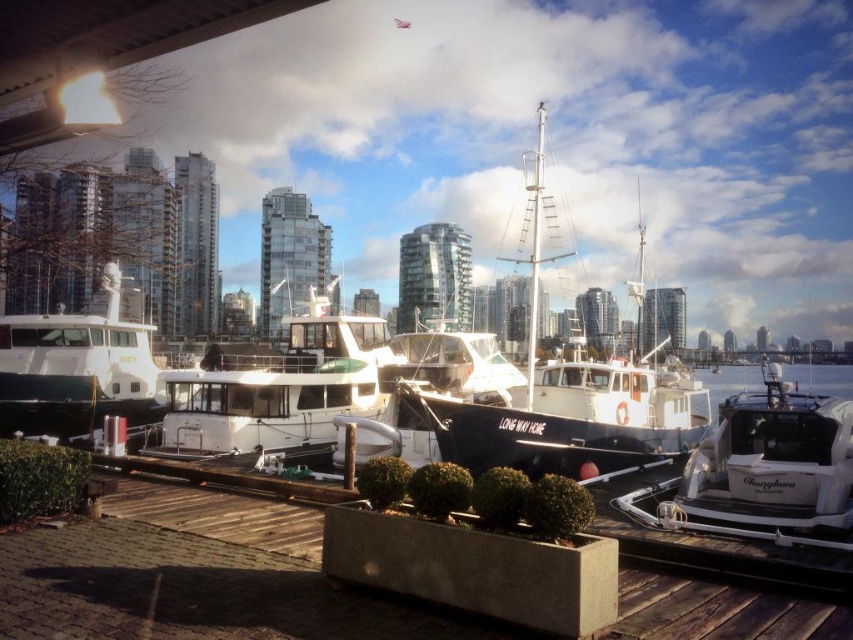
Does white glossy boat at lower right have a larger size compared to white glossy water at center?

Incorrect, white glossy boat at lower right is not larger than white glossy water at center.

Describe the element at coordinates (762, 472) in the screenshot. I see `white glossy boat at lower right` at that location.

Identify the location of white glossy boat at lower right. This screenshot has width=853, height=640. (762, 472).

This screenshot has width=853, height=640. I want to click on white glossy boat at lower right, so click(762, 472).

Looking at this image, is white matte boat at center thinner than white glossy water at center?

Correct, white matte boat at center's width is less than white glossy water at center's.

Is white matte boat at center bigger than white glossy water at center?

No, white matte boat at center is not bigger than white glossy water at center.

The height and width of the screenshot is (640, 853). What do you see at coordinates (317, 384) in the screenshot?
I see `white matte boat at center` at bounding box center [317, 384].

Locate an element on the screen. white matte boat at center is located at coordinates pyautogui.click(x=317, y=384).

Where is `white glossy boat at lower right`? This screenshot has height=640, width=853. white glossy boat at lower right is located at coordinates (762, 472).

Who is more forward, (728, 435) or (86, 349)?

Point (728, 435) is more forward.

Where is `white glossy boat at lower right`? Image resolution: width=853 pixels, height=640 pixels. white glossy boat at lower right is located at coordinates (762, 472).